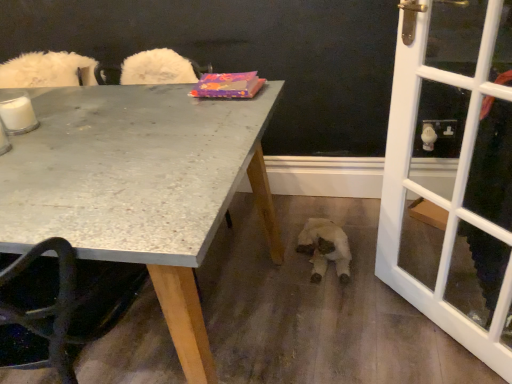
Describe the element at coordinates (139, 187) in the screenshot. I see `granite gray table at upper left` at that location.

What are the coordinates of `granite gray table at upper left` in the screenshot? It's located at (139, 187).

The width and height of the screenshot is (512, 384). I want to click on white plush toy at lower center, so click(x=325, y=248).

Locate an element on the screen. The image size is (512, 384). white glass screen door at right is located at coordinates (452, 172).

Describe the element at coordinates (452, 172) in the screenshot. I see `white glass screen door at right` at that location.

Where is `granite gray table at upper left`? The height and width of the screenshot is (384, 512). granite gray table at upper left is located at coordinates (139, 187).

Is granite gray table at upper left positioned beyond the bounds of white glass screen door at right?

granite gray table at upper left lies outside white glass screen door at right's area.

In the image, is granite gray table at upper left positioned in front of or behind white glass screen door at right?

granite gray table at upper left is positioned closer to the viewer than white glass screen door at right.

Considering the relative sizes of granite gray table at upper left and white glass screen door at right in the image provided, is granite gray table at upper left taller than white glass screen door at right?

Incorrect, the height of granite gray table at upper left is not larger of that of white glass screen door at right.

From the image's perspective, which one is positioned lower, granite gray table at upper left or white glass screen door at right?

granite gray table at upper left, from the image's perspective.

From a real-world perspective, which is physically above, white glass screen door at right or white plush toy at lower center?

white glass screen door at right, from a real-world perspective.

From the image's perspective, is white glass screen door at right located beneath white plush toy at lower center?

Actually, white glass screen door at right appears above white plush toy at lower center in the image.

Which is more to the right, white glass screen door at right or white plush toy at lower center?

From the viewer's perspective, white glass screen door at right appears more on the right side.

Which is closer to the camera, (x=461, y=232) or (x=143, y=249)?

Clearly, point (x=461, y=232) is more distant from the camera than point (x=143, y=249).

Can you confirm if white glass screen door at right is positioned to the left of granite gray table at upper left?

In fact, white glass screen door at right is to the right of granite gray table at upper left.

Is granite gray table at upper left at the back of white glass screen door at right?

No.

Looking at this image, from the image's perspective, is white glass screen door at right below granite gray table at upper left?

No, from the image's perspective, white glass screen door at right is not beneath granite gray table at upper left.

This screenshot has height=384, width=512. In order to click on table above the white plush toy at lower center (from the image's perspective) in this screenshot , I will do `click(139, 187)`.

From the picture: Is white plush toy at lower center at the left side of granite gray table at upper left?

No.

Which of these two, white plush toy at lower center or granite gray table at upper left, is smaller?

With smaller size is white plush toy at lower center.

What's the angular difference between white plush toy at lower center and granite gray table at upper left's facing directions?

There is a 0.405-degree angle between the facing directions of white plush toy at lower center and granite gray table at upper left.

Does white plush toy at lower center have a larger size compared to white glass screen door at right?

No, white plush toy at lower center is not bigger than white glass screen door at right.

Is white plush toy at lower center oriented away from white glass screen door at right?

white plush toy at lower center does not have its back to white glass screen door at right.

Who is taller, white plush toy at lower center or white glass screen door at right?

white glass screen door at right.

From the image's perspective, would you say granite gray table at upper left is shown under white plush toy at lower center?

No, from the image's perspective, granite gray table at upper left is not beneath white plush toy at lower center.

Consider the image. Considering the sizes of granite gray table at upper left and white plush toy at lower center in the image, is granite gray table at upper left taller or shorter than white plush toy at lower center?

In the image, granite gray table at upper left appears to be taller than white plush toy at lower center.

Identify the location of table located on the left of white plush toy at lower center. The image size is (512, 384). (139, 187).

Identify the location of screen door behind the granite gray table at upper left. This screenshot has width=512, height=384. (452, 172).

Image resolution: width=512 pixels, height=384 pixels. I want to click on screen door that is in front of the white plush toy at lower center, so click(452, 172).

From the image, which object appears to be farther from white glass screen door at right, white plush toy at lower center or granite gray table at upper left?

Based on the image, granite gray table at upper left appears to be further to white glass screen door at right.

Estimate the real-world distances between objects in this image. Which object is closer to white glass screen door at right, granite gray table at upper left or white plush toy at lower center?

white plush toy at lower center.

Based on the photo, looking at the image, which one is located further to granite gray table at upper left, white glass screen door at right or white plush toy at lower center?

white plush toy at lower center is further to granite gray table at upper left.

Considering their positions, is white glass screen door at right positioned further to white plush toy at lower center than granite gray table at upper left?

granite gray table at upper left is further to white plush toy at lower center.

Looking at the image, which one is located further to granite gray table at upper left, white plush toy at lower center or white glass screen door at right?

white plush toy at lower center is positioned further to the anchor granite gray table at upper left.

Which object lies further to the anchor point white plush toy at lower center, granite gray table at upper left or white glass screen door at right?

Based on the image, granite gray table at upper left appears to be further to white plush toy at lower center.

Locate an element on the screen. The width and height of the screenshot is (512, 384). animal located between granite gray table at upper left and white glass screen door at right in the left-right direction is located at coordinates (325, 248).